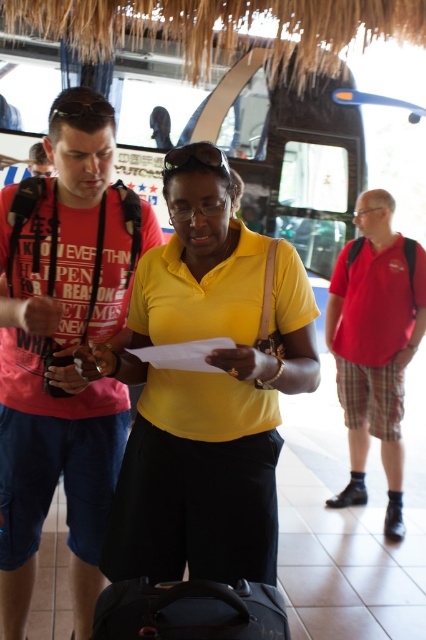
Question: Which object is positioned closest to the yellow matte shirt at center?

Choices:
 (A) matte red t-shirt at left
 (B) black leather suitcase at lower center

Answer: (A)

Question: Which point is farther to the camera?

Choices:
 (A) red plaid shorts at right
 (B) yellow matte shirt at center

Answer: (A)

Question: Which object is farther from the camera taking this photo?

Choices:
 (A) matte red t-shirt at left
 (B) yellow matte shirt at center
 (C) red plaid shorts at right
 (D) black leather suitcase at lower center

Answer: (C)

Question: Does yellow matte shirt at center appear under red plaid shorts at right?

Choices:
 (A) no
 (B) yes

Answer: (A)

Question: Observing the image, what is the correct spatial positioning of matte red t-shirt at left in reference to black leather suitcase at lower center?

Choices:
 (A) right
 (B) left

Answer: (B)

Question: Is yellow matte shirt at center thinner than red plaid shorts at right?

Choices:
 (A) no
 (B) yes

Answer: (A)